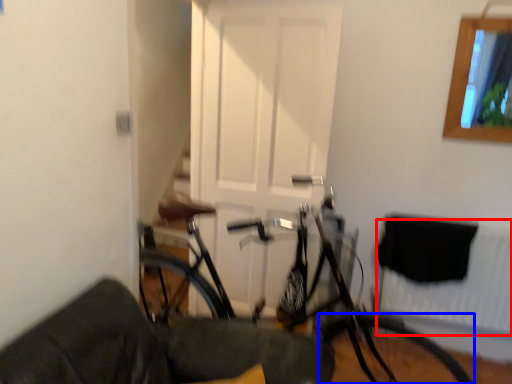
Question: Which object is further to the camera taking this photo, radiator (highlighted by a red box) or bicycle wheel (highlighted by a blue box)?

Choices:
 (A) radiator
 (B) bicycle wheel

Answer: (A)